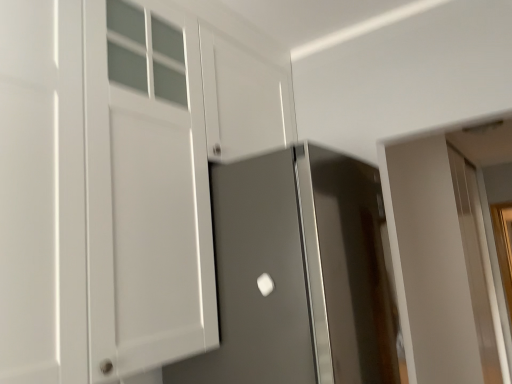
Question: Does white matte cabinet at left have a lesser width compared to white glossy door handle at center?

Choices:
 (A) yes
 (B) no

Answer: (B)

Question: Is white matte cabinet at left looking in the opposite direction of white glossy door handle at center?

Choices:
 (A) yes
 (B) no

Answer: (B)

Question: From the image's perspective, would you say white matte cabinet at left is shown under white glossy door handle at center?

Choices:
 (A) no
 (B) yes

Answer: (A)

Question: Considering the relative sizes of white matte cabinet at left and white glossy door handle at center in the image provided, is white matte cabinet at left shorter than white glossy door handle at center?

Choices:
 (A) yes
 (B) no

Answer: (B)

Question: Could you tell me if white matte cabinet at left is facing white glossy door handle at center?

Choices:
 (A) no
 (B) yes

Answer: (B)

Question: Choose the correct answer: Is white glossy door handle at center inside satin gray door at center, which is the second door from back to front, or outside it?

Choices:
 (A) inside
 (B) outside

Answer: (B)

Question: Relative to satin gray door at center, positioned as the first door in front-to-back order, is white glossy door handle at center in front or behind?

Choices:
 (A) behind
 (B) front

Answer: (A)

Question: From the image's perspective, relative to satin gray door at center, which is the 1th door from left to right, is white glossy door handle at center above or below?

Choices:
 (A) above
 (B) below

Answer: (A)

Question: From a real-world perspective, is white glossy door handle at center physically located above or below satin gray door at center, the second door from the right?

Choices:
 (A) above
 (B) below

Answer: (A)

Question: Considering the positions of satin gray door at center, the second door from the right, and white matte cabinet at left in the image, is satin gray door at center, the second door from the right, bigger or smaller than white matte cabinet at left?

Choices:
 (A) small
 (B) big

Answer: (B)

Question: From a real-world perspective, is satin gray door at center, positioned as the first door in front-to-back order, physically located above or below white matte cabinet at left?

Choices:
 (A) above
 (B) below

Answer: (B)

Question: Is point (282, 235) closer or farther from the camera than point (174, 9)?

Choices:
 (A) closer
 (B) farther

Answer: (A)

Question: Is satin gray door at center, the second door from the right, spatially inside white matte cabinet at left, or outside of it?

Choices:
 (A) outside
 (B) inside

Answer: (A)

Question: From a real-world perspective, relative to white glossy door at right, the 1th door positioned from the back, is white glossy door handle at center vertically above or below?

Choices:
 (A) below
 (B) above

Answer: (B)

Question: Does point (271, 281) appear closer or farther from the camera than point (439, 344)?

Choices:
 (A) farther
 (B) closer

Answer: (B)